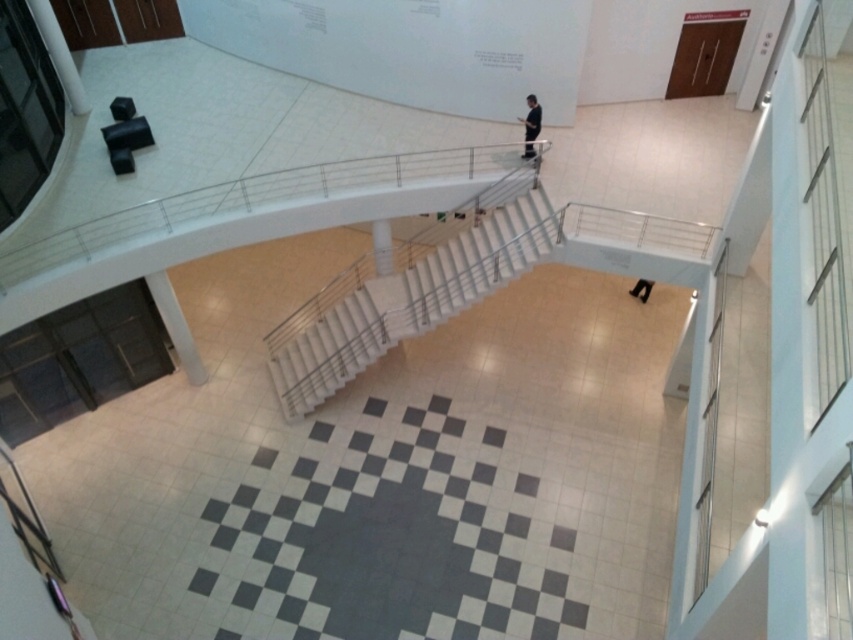
Between white glossy stairs at center and black smooth suit at center, which one appears on the left side from the viewer's perspective?

white glossy stairs at center

Can you confirm if white glossy stairs at center is bigger than black smooth suit at center?

Yes, white glossy stairs at center is bigger than black smooth suit at center.

At what (x,y) coordinates should I click in order to perform the action: click on white glossy stairs at center. Please return your answer as a coordinate pair (x, y). Looking at the image, I should click on (412, 300).

Between white glossy stairs at center and black leather shoes at lower center, which one appears on the left side from the viewer's perspective?

From the viewer's perspective, white glossy stairs at center appears more on the left side.

Based on the photo, can you confirm if white glossy stairs at center is smaller than black leather shoes at lower center?

Actually, white glossy stairs at center might be larger than black leather shoes at lower center.

The width and height of the screenshot is (853, 640). What are the coordinates of `white glossy stairs at center` in the screenshot? It's located at (412, 300).

Can you confirm if black smooth suit at center is positioned to the left of black leather shoes at lower center?

Indeed, black smooth suit at center is positioned on the left side of black leather shoes at lower center.

Which is behind, point (526, 128) or point (639, 292)?

The point (639, 292) is more distant.

The image size is (853, 640). I want to click on black smooth suit at center, so click(x=531, y=118).